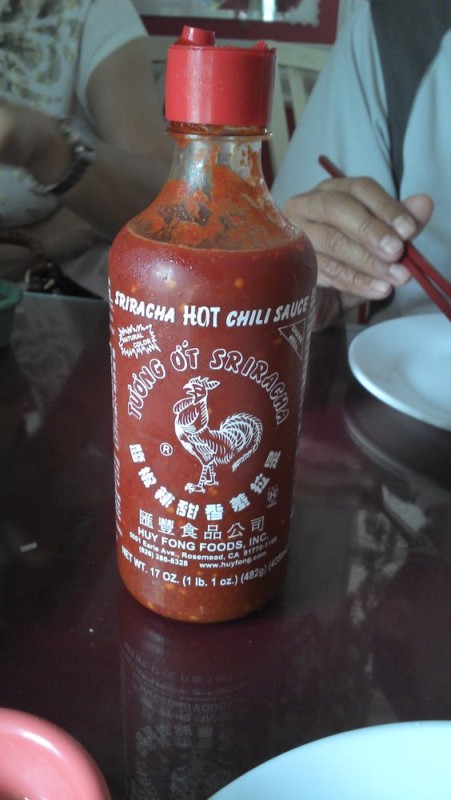
This screenshot has height=800, width=451. What are the coordinates of `table` in the screenshot? It's located at (355, 568).